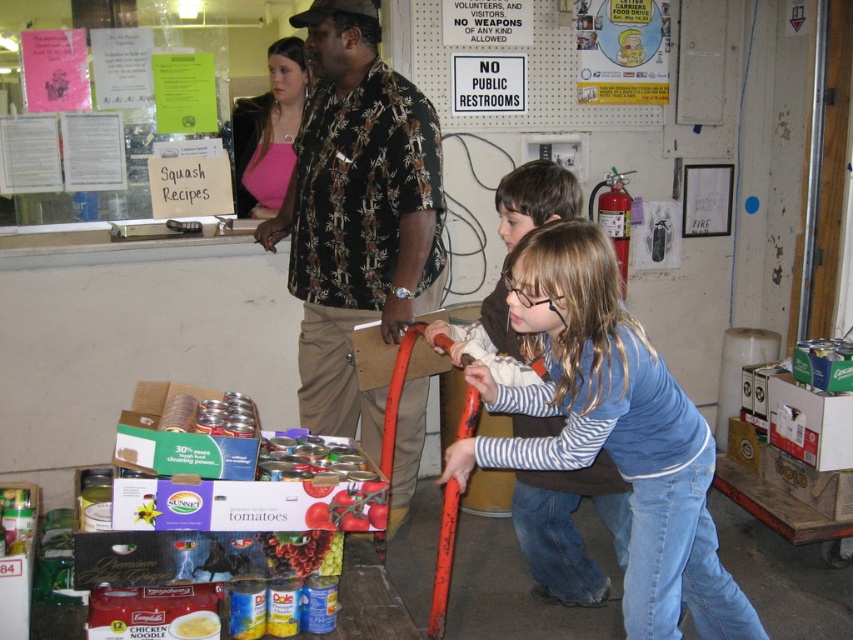
Question: Is blue striped shirt at center to the right of pink matte shirt at upper center from the viewer's perspective?

Choices:
 (A) no
 (B) yes

Answer: (B)

Question: Among these points, which one is farthest from the camera?

Choices:
 (A) (564, 323)
 (B) (294, 563)
 (C) (235, 180)

Answer: (C)

Question: Does printed fabric shirt at center appear on the right side of pink matte shirt at upper center?

Choices:
 (A) no
 (B) yes

Answer: (B)

Question: Which is farther from the blue striped shirt at center?

Choices:
 (A) pink matte shirt at upper center
 (B) matte yellow can at lower left

Answer: (A)

Question: Which point is closer to the camera taking this photo?

Choices:
 (A) (183, 634)
 (B) (403, 461)
 (C) (675, 586)

Answer: (A)

Question: Can you confirm if printed fabric shirt at center is smaller than blue striped shirt at center?

Choices:
 (A) no
 (B) yes

Answer: (A)